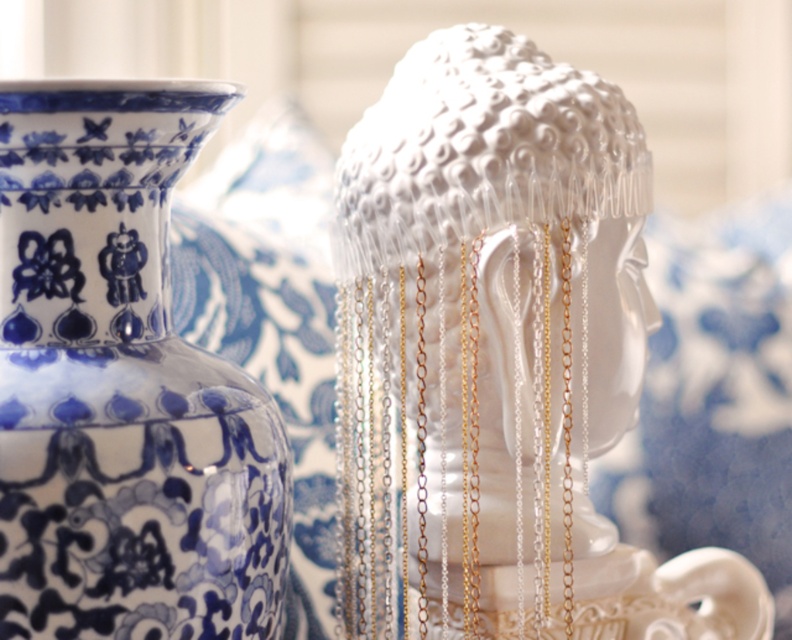
Question: Does white glossy headpiece at center come in front of blue porcelain vase at upper left?

Choices:
 (A) no
 (B) yes

Answer: (A)

Question: Considering the relative positions of white glossy headpiece at center and blue porcelain vase at upper left in the image provided, where is white glossy headpiece at center located with respect to blue porcelain vase at upper left?

Choices:
 (A) left
 (B) right

Answer: (B)

Question: Among these points, which one is farthest from the camera?

Choices:
 (A) (210, 104)
 (B) (478, 477)

Answer: (B)

Question: Does white glossy headpiece at center lie in front of blue porcelain vase at upper left?

Choices:
 (A) no
 (B) yes

Answer: (A)

Question: Which of the following is the closest to the observer?

Choices:
 (A) pyautogui.click(x=124, y=218)
 (B) pyautogui.click(x=427, y=394)

Answer: (A)

Question: Which object appears closest to the camera in this image?

Choices:
 (A) blue porcelain vase at upper left
 (B) white glossy headpiece at center

Answer: (A)